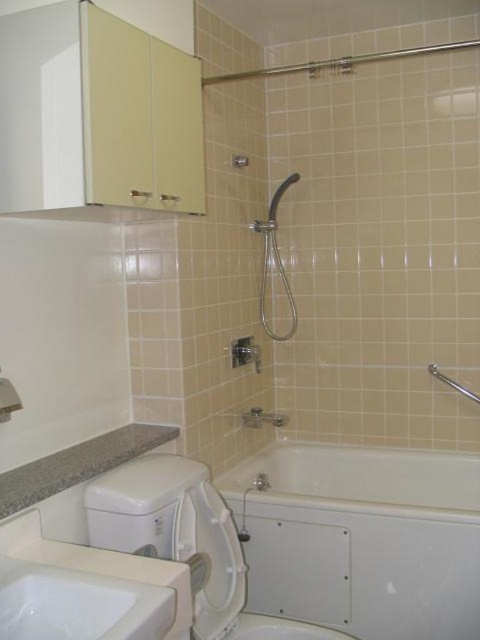
You are a delivery person holding a package that needs to be placed on the countertop next to the white ceramic sink at lower left. The package is 1.2 meters long. Can you fit the package horizontally on the countertop without it hanging off the edge?

The distance between the white ceramic sink at lower left and the camera is 1.05 meters. Since the package is 1.2 meters long, it is longer than the available space between the sink and the camera, so it cannot be placed horizontally without hanging off the edge.

You are standing in the bathroom and want to reach both the point at coordinate (147, 438) and the point at coordinate (264, 253). Which point will you reach first?

You will reach point (147, 438) first because it is closer to you than point (264, 253).

You are a plumber trying to install a new pipe connection between the granite countertop at lower left and the matte silver shower head at center. The pipe you have is 1 meter long. Based on the image, will the pipe be long enough to connect them?

The granite countertop at lower left is 1.15 meters away from the matte silver shower head at center. Since the pipe is only 1 meter long, it is not long enough to reach the required distance between the two points.